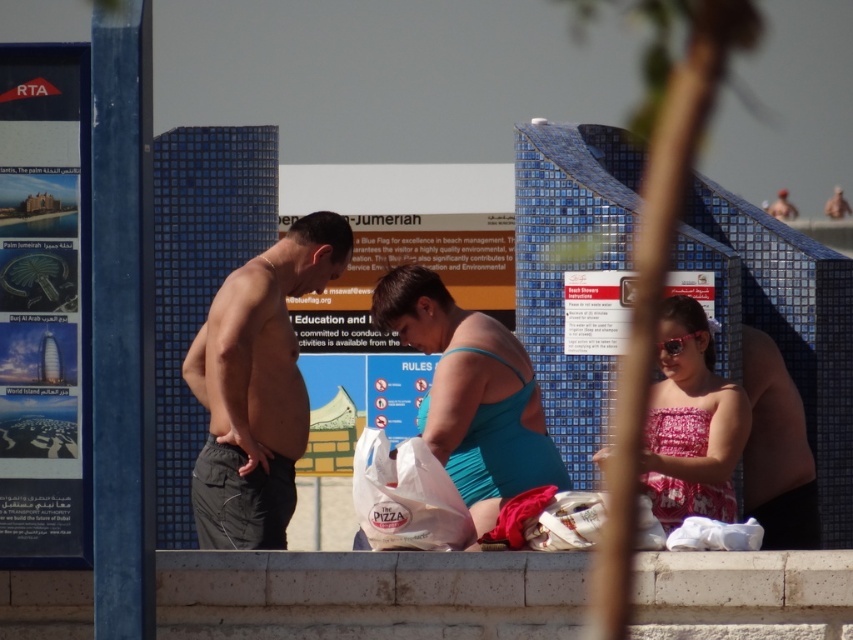
Question: Is white concrete ledge at lower center positioned in front of white plastic bag at center?

Choices:
 (A) no
 (B) yes

Answer: (B)

Question: Which point is farther to the camera?

Choices:
 (A) 534,588
 (B) 709,509
 (C) 397,500

Answer: (B)

Question: Which point appears closest to the camera in this image?

Choices:
 (A) (714, 611)
 (B) (764, 500)
 (C) (283, 424)

Answer: (A)

Question: Which of the following is the closest to the observer?

Choices:
 (A) smooth skin torso at center
 (B) white plastic bag at center
 (C) white concrete ledge at lower center
 (D) teal fabric swimsuit at center

Answer: (C)

Question: Is white concrete ledge at lower center positioned behind white plastic bag at center?

Choices:
 (A) yes
 (B) no

Answer: (B)

Question: Is gray fabric shorts at left smaller than white plastic bag at center?

Choices:
 (A) no
 (B) yes

Answer: (B)